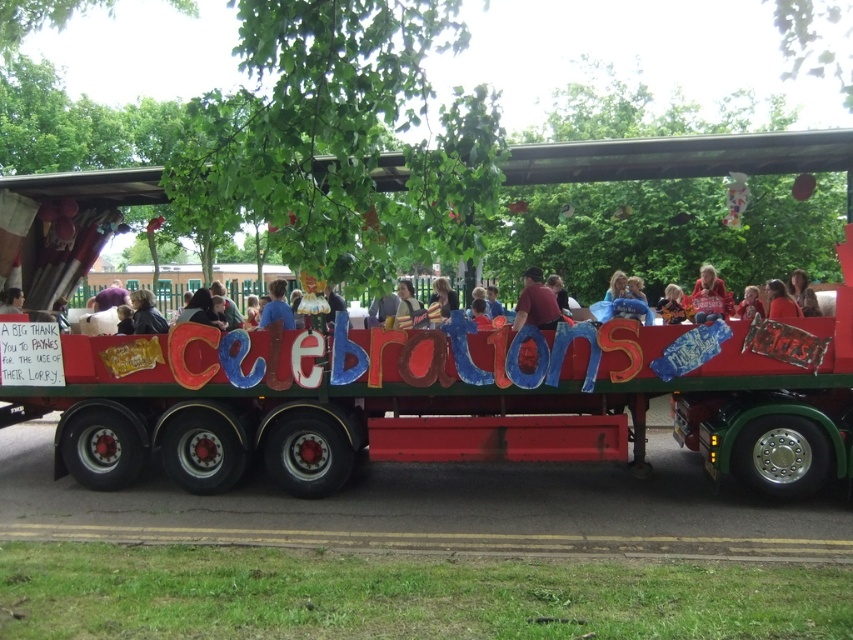
You are a photographer at the parade and want to capture both the dark brown leather jacket at center and the smooth red shirt at center in a single shot. Which one should you focus on first to ensure both are in frame?

The dark brown leather jacket at center is below the smooth red shirt at center, so focusing on the smooth red shirt at center first will allow you to adjust the camera angle downward to include the dark brown leather jacket at center in the frame.

You are a photographer at the parade and want to capture both the smooth brown hair at center and the light brown fabric at center in a single shot. Which object should you focus on first to ensure both are in frame?

The smooth brown hair at center is located above the light brown fabric at center, so you should focus on the light brown fabric at center first to ensure the entire area from bottom to top is captured in the frame.

You are a photographer standing at the front of the lorry during the parade. You want to take a photo that includes both the dark brown leather jacket at center and the smooth red shirt at center. Given that your camera has a maximum focus range of 20 feet, will you be able to capture both subjects in focus?

The dark brown leather jacket at center and the smooth red shirt at center are 20.29 feet apart. Since the distance between them exceeds the camera lens focus range of 20 feet, the photographer will not be able to capture both subjects in focus simultaneously.